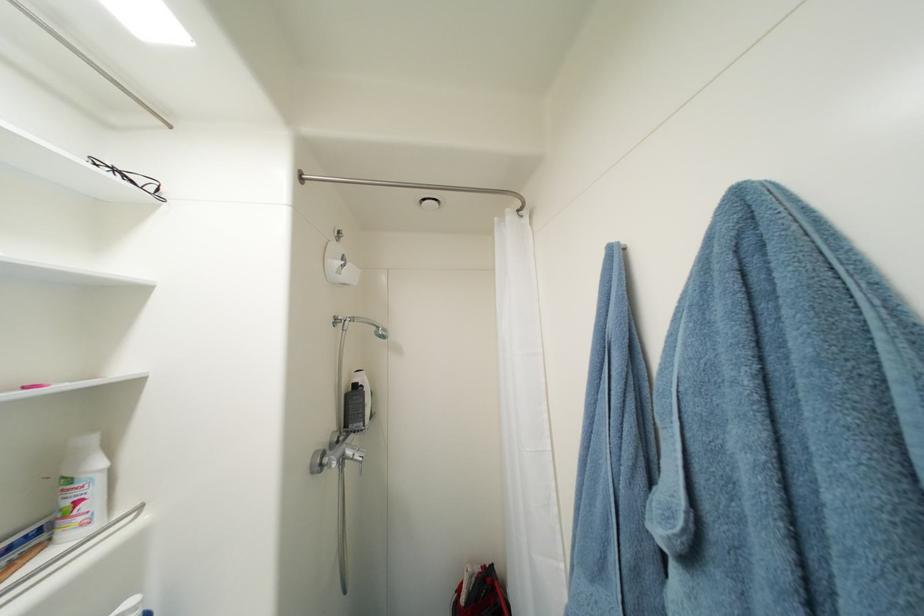
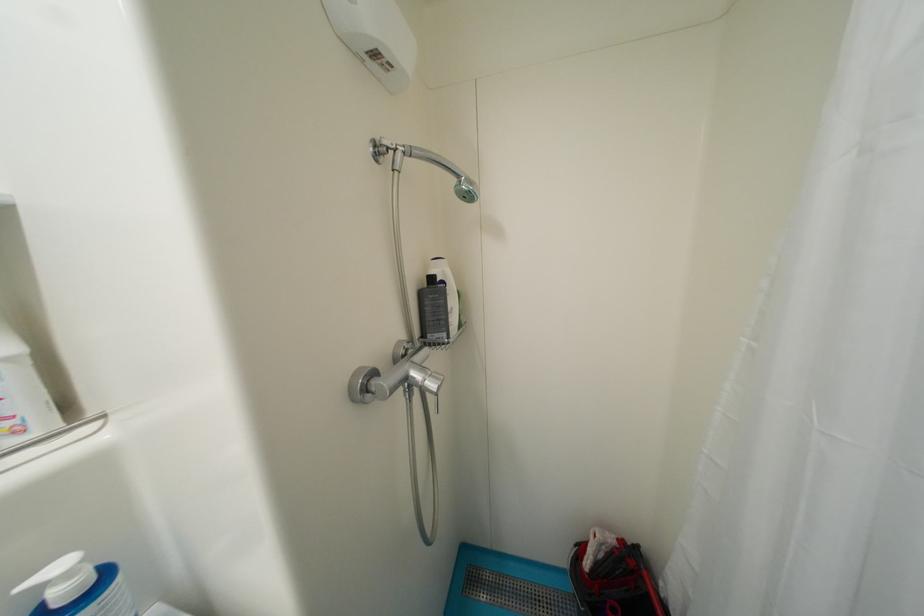
In the second image, find the point that corresponds to (x=361, y=387) in the first image.

(439, 281)